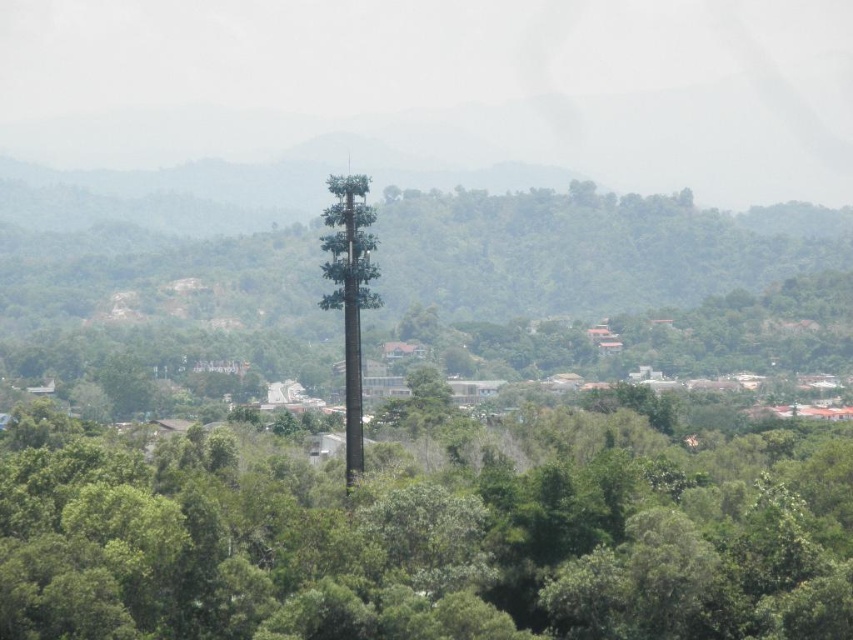
From the picture: You are an engineer inspecting the telecommunications equipment in the image. You need to determine which object, the green matte pole at center or the green matte tower at center, has a greater width to ensure proper equipment installation. Which one is wider?

The green matte pole at center is wider than the green matte tower at center, so the pole has a greater width for equipment installation.

You are a hiker standing in the forest and see the green matte pole at center and the green matte tower at center. Which object is closer to the ground?

The green matte pole at center is located below the green matte tower at center, so it is closer to the ground.